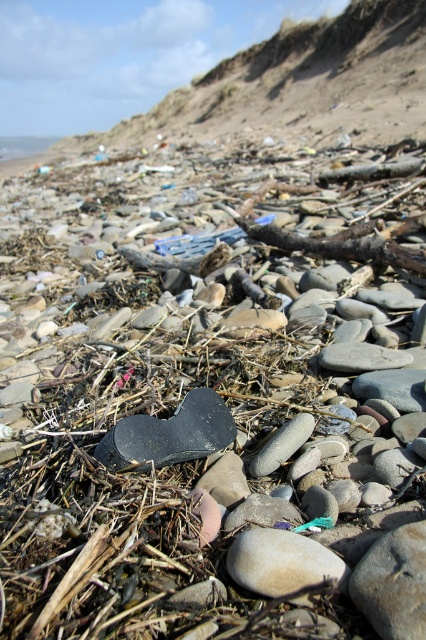
You are a beach cleaner and need to decide whether to place the black matte sandal at center into a trash bin that can hold items up to the width of the smooth beige rock at center. Can the sandal fit into the bin?

The black matte sandal at center might be wider than smooth beige rock at center, so it may not fit into the bin if the bin is sized exactly to the rock.

You are a beach cleanup volunteer and need to pick up the black matte sandal at center and the smooth gray rock at center. Which object should you pick up first if you want to start with the one that is on top?

The black matte sandal at center is positioned over smooth gray rock at center, so you should pick up the black matte sandal at center first.

You are a beach cleaner and need to decide which item to pick up first between the black matte sandal at center and the smooth beige rock at center. Based on their sizes, which one should you prioritize?

The black matte sandal at center is larger in size than the smooth beige rock at center, so you should prioritize picking up the black matte sandal at center first.